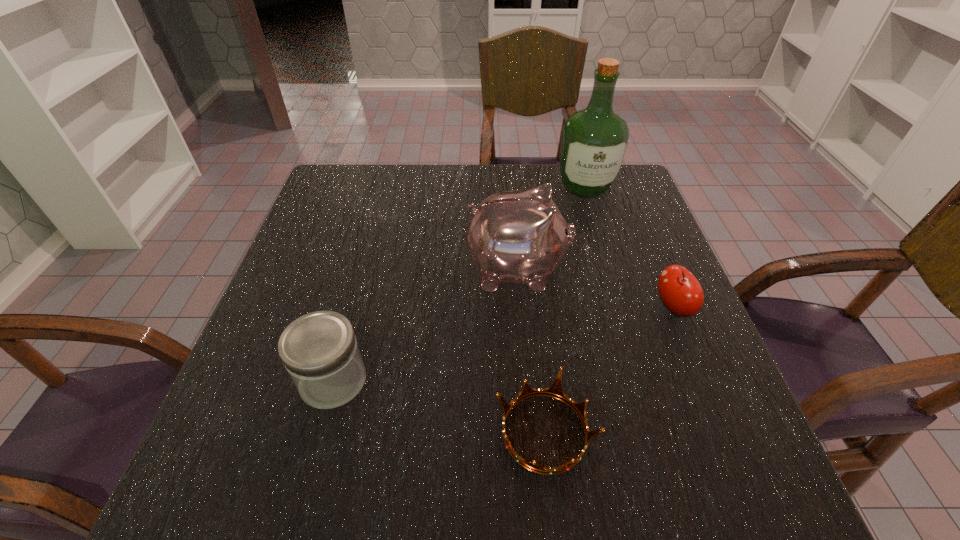
Image resolution: width=960 pixels, height=540 pixels. Find the location of `vacant space that is in between the fourth shortest object and the apple`. vacant space that is in between the fourth shortest object and the apple is located at coordinates (595, 289).

The height and width of the screenshot is (540, 960). In order to click on vacant point located between the apple and the liquor in this screenshot , I will do `click(629, 247)`.

The image size is (960, 540). Identify the location of unoccupied position between the second shortest object and the liquor. (629, 247).

The image size is (960, 540). What are the coordinates of `free space between the second tallest object and the second shortest object` in the screenshot? It's located at tap(595, 289).

Where is `blank region between the crown and the apple`? blank region between the crown and the apple is located at coordinates (609, 370).

This screenshot has width=960, height=540. Find the location of `free space between the jar and the tallest object`. free space between the jar and the tallest object is located at coordinates (459, 284).

Image resolution: width=960 pixels, height=540 pixels. I want to click on free space that is in between the leftmost object and the tallest object, so click(459, 284).

Where is `empty space that is in between the second shortest object and the jar`? empty space that is in between the second shortest object and the jar is located at coordinates (503, 344).

Choose which object is the second nearest neighbor to the shortest object. Please provide its 2D coordinates. Your answer should be formatted as a tuple, i.e. [(x, y)], where the tuple contains the x and y coordinates of a point satisfying the conditions above.

[(679, 290)]

You are a GUI agent. You are given a task and a screenshot of the screen. Output one action in this format:
    pyautogui.click(x=<x>, y=<y>)
    Task: Click on the second closest object to the liquor
    The width and height of the screenshot is (960, 540).
    Given the screenshot: What is the action you would take?
    pyautogui.click(x=679, y=290)